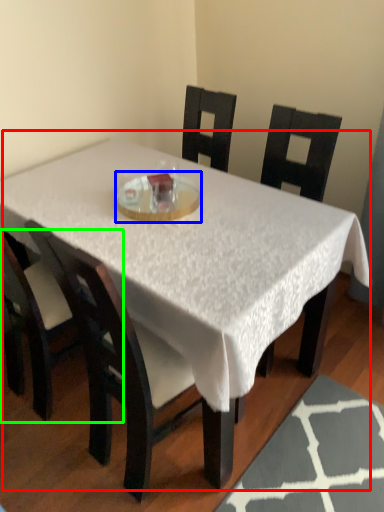
Question: Which object is the farthest from table (highlighted by a red box)? Choose among these: glass plate (highlighted by a blue box) or chair (highlighted by a green box).

Choices:
 (A) glass plate
 (B) chair

Answer: (B)